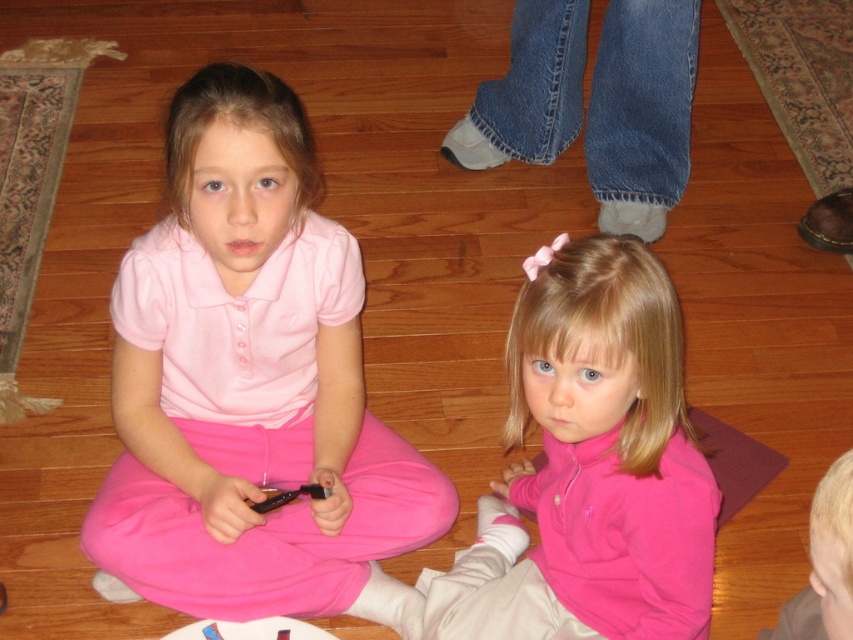
Question: Observing the image, what is the correct spatial positioning of matte pink shirt at center in reference to denim jeans at upper center?

Choices:
 (A) above
 (B) below

Answer: (B)

Question: Considering the real-world distances, which object is farthest from the pink fleece jacket at lower center?

Choices:
 (A) denim jeans at upper center
 (B) matte pink shirt at center

Answer: (A)

Question: Which is nearer to the denim jeans at upper center?

Choices:
 (A) matte pink shirt at center
 (B) pink fleece jacket at lower center

Answer: (B)

Question: Is matte pink shirt at center smaller than pink fleece jacket at lower center?

Choices:
 (A) yes
 (B) no

Answer: (B)

Question: Where is pink fleece jacket at lower center located in relation to denim jeans at upper center in the image?

Choices:
 (A) above
 (B) below

Answer: (B)

Question: Which point is closer to the camera taking this photo?

Choices:
 (A) (453, 563)
 (B) (532, 81)
 (C) (236, 461)

Answer: (C)